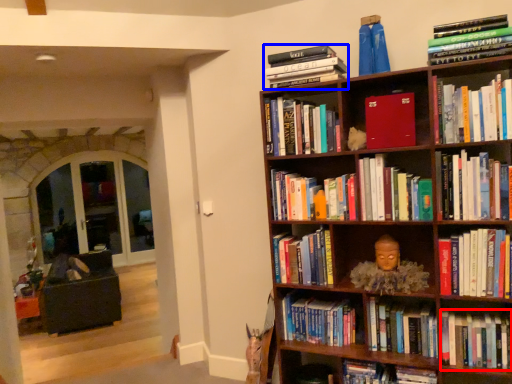
Question: Which of the following is the farthest to the observer, book (highlighted by a red box) or book (highlighted by a blue box)?

Choices:
 (A) book
 (B) book

Answer: (B)